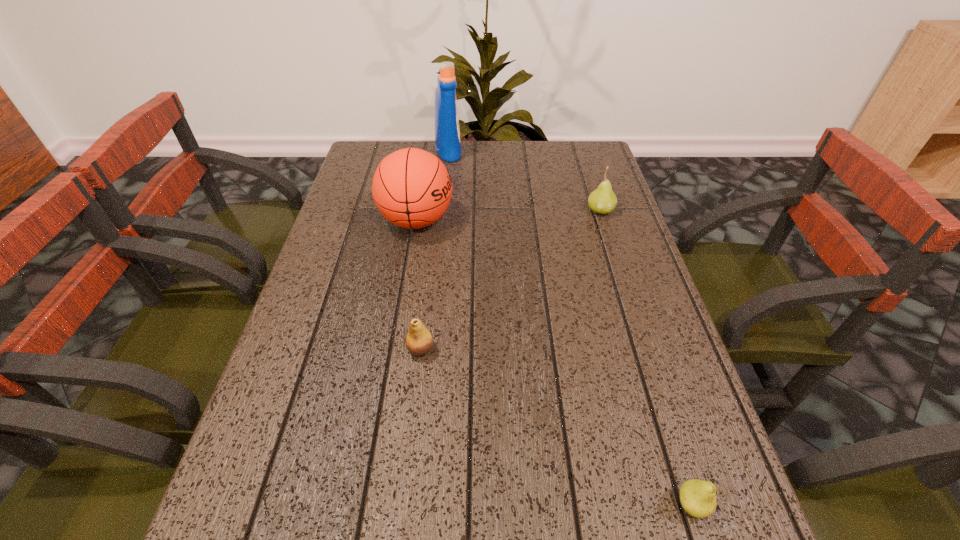
The width and height of the screenshot is (960, 540). What are the coordinates of `the tallest object` in the screenshot? It's located at (447, 132).

You are a GUI agent. You are given a task and a screenshot of the screen. Output one action in this format:
    pyautogui.click(x=<x>, y=<y>)
    Task: Click on the detergent
    The image size is (960, 540).
    Given the screenshot: What is the action you would take?
    pyautogui.click(x=447, y=132)

The height and width of the screenshot is (540, 960). In order to click on the fourth shortest object in this screenshot , I will do click(x=412, y=188).

The width and height of the screenshot is (960, 540). In order to click on the farthest pear in this screenshot , I will do `click(603, 200)`.

Locate an element on the screen. The image size is (960, 540). the leftmost pear is located at coordinates (419, 341).

Locate an element on the screen. This screenshot has height=540, width=960. the second nearest object is located at coordinates (419, 341).

At what (x,y) coordinates should I click in order to perform the action: click on the nearest pear. Please return your answer as a coordinate pair (x, y). This screenshot has height=540, width=960. Looking at the image, I should click on (697, 497).

The height and width of the screenshot is (540, 960). Identify the location of vacant space located on the label of the detergent. (505, 151).

You are a GUI agent. You are given a task and a screenshot of the screen. Output one action in this format:
    pyautogui.click(x=<x>, y=<y>)
    Task: Click on the blank area located on the side with logo of the basketball
    The image size is (960, 540).
    Given the screenshot: What is the action you would take?
    pyautogui.click(x=581, y=220)

The height and width of the screenshot is (540, 960). I want to click on vacant space located 0.110m on the left of the farthest pear, so click(546, 210).